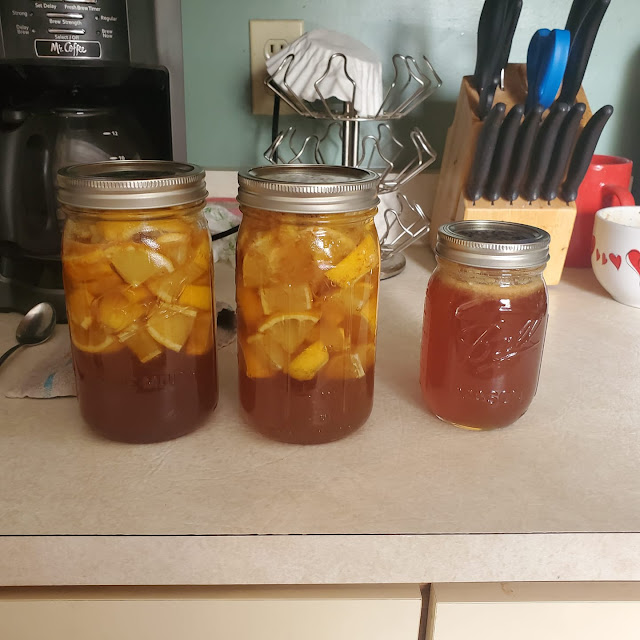
The width and height of the screenshot is (640, 640). I want to click on spoon, so click(27, 316).